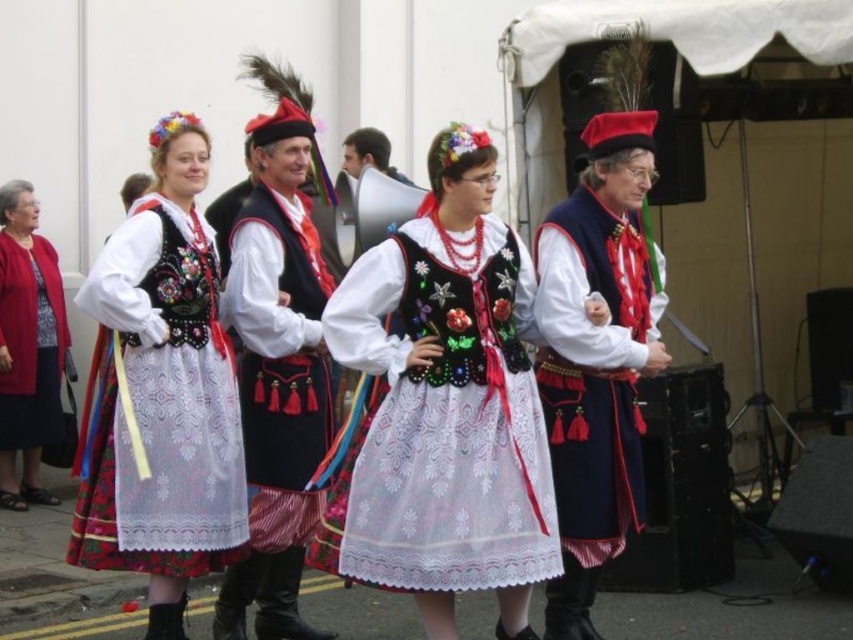
You are a photographer who wants to capture a clear photo of the embroidered fabric dress at center without the velvet dark blue vest at center blocking it. Based on the scene description, is this possible?

Yes, because the embroidered fabric dress at center is in front of the velvet dark blue vest at center, so the dress will not be blocked by the vest in the photo.

You are standing in front of the stage at the cultural event. There are two points marked in the scene. The first point is at coordinate point (335, 355) and the second is at point (32, 356). Which point is closer to you?

Point (335, 355) is closer to the viewer than point (32, 356).